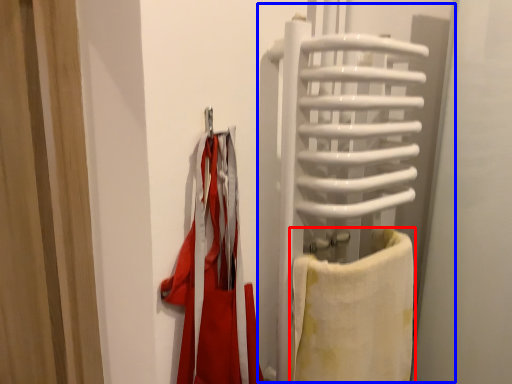
Question: Which object is closer to the camera taking this photo, towel (highlighted by a red box) or screen door (highlighted by a blue box)?

Choices:
 (A) towel
 (B) screen door

Answer: (B)